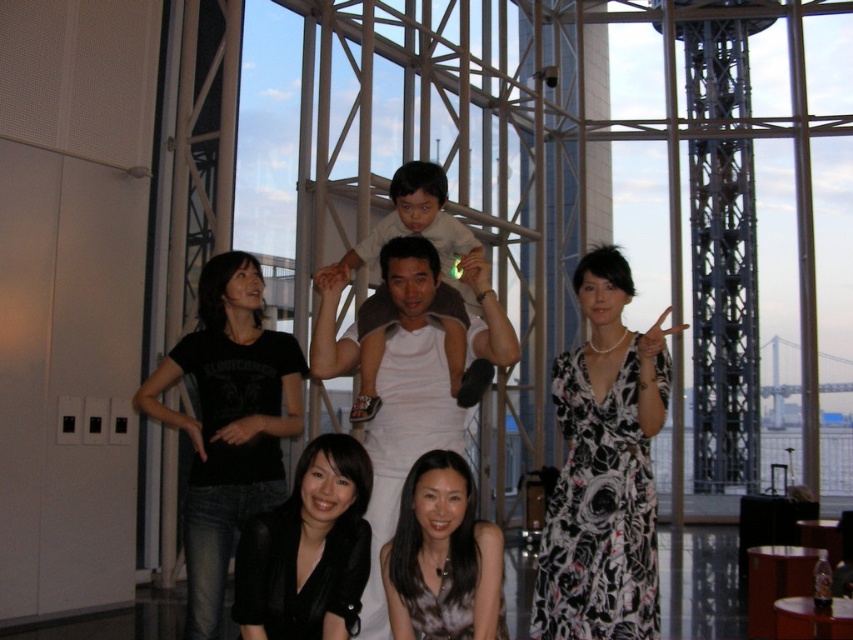
Question: Based on their relative distances, which object is nearer to the black floral dress at center?

Choices:
 (A) black cotton t-shirt at lower left
 (B) black satin dress at lower center
 (C) white cotton tank top at center
 (D) black satin blouse at lower center

Answer: (B)

Question: Is white cotton tank top at center closer to the viewer compared to black satin dress at lower center?

Choices:
 (A) yes
 (B) no

Answer: (B)

Question: Does black floral dress at center appear over black satin blouse at lower center?

Choices:
 (A) yes
 (B) no

Answer: (A)

Question: Which of the following is the closest to the observer?

Choices:
 (A) black floral dress at center
 (B) black satin blouse at lower center
 (C) black satin dress at lower center
 (D) white cotton tank top at center

Answer: (B)

Question: Is black satin blouse at lower center above black satin dress at lower center?

Choices:
 (A) no
 (B) yes

Answer: (B)

Question: Which of the following is the farthest from the observer?

Choices:
 (A) (239, 637)
 (B) (392, 372)

Answer: (B)